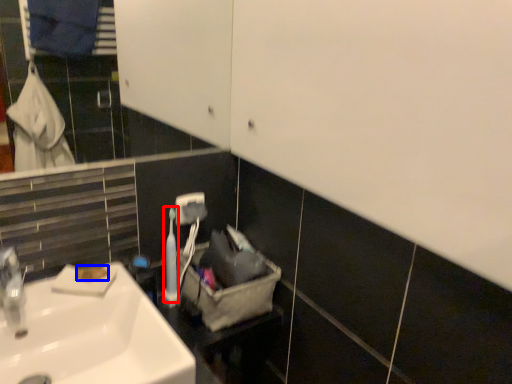
Question: Among these objects, which one is farthest to the camera, toiletry (highlighted by a red box) or soap (highlighted by a blue box)?

Choices:
 (A) toiletry
 (B) soap

Answer: (A)